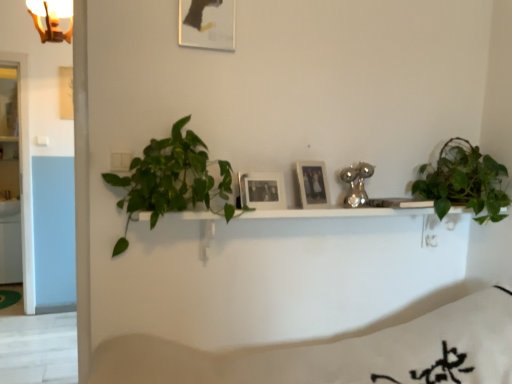
Describe the element at coordinates (207, 24) in the screenshot. I see `matte black picture frame at upper center, marked as the third picture frame in a right-to-left arrangement` at that location.

The width and height of the screenshot is (512, 384). What do you see at coordinates (313, 184) in the screenshot?
I see `matte black picture frame at center, the second picture frame positioned from the bottom` at bounding box center [313, 184].

Find the location of a particular element. This screenshot has height=384, width=512. white matte bedding at lower center is located at coordinates (338, 353).

The width and height of the screenshot is (512, 384). I want to click on green leafy plant at left, which ranks as the second houseplant in right-to-left order, so click(172, 180).

Describe the element at coordinates (464, 181) in the screenshot. I see `green matte plant at upper right, acting as the first houseplant starting from the right` at that location.

Where is `matte black picture frame at upper center, marked as the third picture frame in a right-to-left arrangement`? matte black picture frame at upper center, marked as the third picture frame in a right-to-left arrangement is located at coordinates (207, 24).

Considering the relative sizes of green matte plant at upper right, acting as the first houseplant starting from the right, and green leafy plant at left, marked as the first houseplant in a left-to-right arrangement, in the image provided, is green matte plant at upper right, acting as the first houseplant starting from the right, smaller than green leafy plant at left, marked as the first houseplant in a left-to-right arrangement,?

Correct, green matte plant at upper right, acting as the first houseplant starting from the right, occupies less space than green leafy plant at left, marked as the first houseplant in a left-to-right arrangement.

From a real-world perspective, who is located lower, green matte plant at upper right, placed as the 2th houseplant when sorted from left to right, or green leafy plant at left, marked as the first houseplant in a left-to-right arrangement?

From a 3D spatial view, green leafy plant at left, marked as the first houseplant in a left-to-right arrangement, is below.

Considering the relative sizes of green matte plant at upper right, acting as the first houseplant starting from the right, and green leafy plant at left, which ranks as the second houseplant in right-to-left order, in the image provided, is green matte plant at upper right, acting as the first houseplant starting from the right, taller than green leafy plant at left, which ranks as the second houseplant in right-to-left order,?

Incorrect, the height of green matte plant at upper right, acting as the first houseplant starting from the right, is not larger of that of green leafy plant at left, which ranks as the second houseplant in right-to-left order.

How many degrees apart are the facing directions of green matte plant at upper right, acting as the first houseplant starting from the right, and green leafy plant at left, marked as the first houseplant in a left-to-right arrangement?

1.12 degrees.

From their relative heights in the image, would you say matte black picture frame at center, the first picture frame positioned from the right, is taller or shorter than matte black picture frame at upper center, the 1th picture frame positioned from the top?

In the image, matte black picture frame at center, the first picture frame positioned from the right, appears to be shorter than matte black picture frame at upper center, the 1th picture frame positioned from the top.

Does matte black picture frame at center, positioned as the third picture frame in left-to-right order, appear on the right side of matte black picture frame at upper center, the third picture frame when ordered from bottom to top?

Correct, you'll find matte black picture frame at center, positioned as the third picture frame in left-to-right order, to the right of matte black picture frame at upper center, the third picture frame when ordered from bottom to top.

From a real-world perspective, is matte black picture frame at center, acting as the second picture frame starting from the top, on top of matte black picture frame at upper center, marked as the third picture frame in a right-to-left arrangement?

No.

Which of these two, matte black picture frame at center, positioned as the third picture frame in left-to-right order, or matte black picture frame at upper center, the third picture frame when ordered from bottom to top, is smaller?

With smaller size is matte black picture frame at center, positioned as the third picture frame in left-to-right order.

Which object is wider, matte black picture frame at upper center, the 1th picture frame positioned from the top, or green leafy plant at left, marked as the first houseplant in a left-to-right arrangement?

Wider between the two is green leafy plant at left, marked as the first houseplant in a left-to-right arrangement.

Does matte black picture frame at upper center, the third picture frame when ordered from bottom to top, turn towards green leafy plant at left, which ranks as the second houseplant in right-to-left order?

No, matte black picture frame at upper center, the third picture frame when ordered from bottom to top, is not aimed at green leafy plant at left, which ranks as the second houseplant in right-to-left order.

Consider the image. Would you say matte black picture frame at upper center, the third picture frame when ordered from bottom to top, is a long distance from green leafy plant at left, which ranks as the second houseplant in right-to-left order?

No, matte black picture frame at upper center, the third picture frame when ordered from bottom to top, is not far from green leafy plant at left, which ranks as the second houseplant in right-to-left order.

Can you tell me how much matte black picture frame at upper center, the 1th picture frame positioned from the top, and green leafy plant at left, marked as the first houseplant in a left-to-right arrangement, differ in facing direction?

The angular difference between matte black picture frame at upper center, the 1th picture frame positioned from the top, and green leafy plant at left, marked as the first houseplant in a left-to-right arrangement, is 0.513 degrees.

Can you tell me how much matte black picture frame at upper center, marked as the third picture frame in a right-to-left arrangement, and green matte plant at upper right, acting as the first houseplant starting from the right, differ in facing direction?

1.63 degrees separate the facing orientations of matte black picture frame at upper center, marked as the third picture frame in a right-to-left arrangement, and green matte plant at upper right, acting as the first houseplant starting from the right.

From the image's perspective, relative to green matte plant at upper right, placed as the 2th houseplant when sorted from left to right, is matte black picture frame at upper center, the third picture frame when ordered from bottom to top, above or below?

matte black picture frame at upper center, the third picture frame when ordered from bottom to top, is situated higher than green matte plant at upper right, placed as the 2th houseplant when sorted from left to right, in the image.

Is matte black picture frame at upper center, the 1th picture frame positioned from the top, at the left side of green matte plant at upper right, acting as the first houseplant starting from the right?

Indeed, matte black picture frame at upper center, the 1th picture frame positioned from the top, is positioned on the left side of green matte plant at upper right, acting as the first houseplant starting from the right.

Which is nearer, [222,32] or [496,203]?

The point [222,32] is closer.

How different are the orientations of white matte bedding at lower center and green leafy plant at left, which ranks as the second houseplant in right-to-left order, in degrees?

The facing directions of white matte bedding at lower center and green leafy plant at left, which ranks as the second houseplant in right-to-left order, are 0.209 degrees apart.

You are a GUI agent. You are given a task and a screenshot of the screen. Output one action in this format:
    pyautogui.click(x=<x>, y=<y>)
    Task: Click on the bedding on the right side of green leafy plant at left, marked as the first houseplant in a left-to-right arrangement
    The height and width of the screenshot is (384, 512).
    Given the screenshot: What is the action you would take?
    pyautogui.click(x=338, y=353)

Considering the relative sizes of white matte bedding at lower center and green leafy plant at left, marked as the first houseplant in a left-to-right arrangement, in the image provided, is white matte bedding at lower center wider than green leafy plant at left, marked as the first houseplant in a left-to-right arrangement,?

Yes, white matte bedding at lower center is wider than green leafy plant at left, marked as the first houseplant in a left-to-right arrangement.

Based on the photo, considering the positions of objects white matte bedding at lower center and green leafy plant at left, which ranks as the second houseplant in right-to-left order, in the image provided, who is more to the left, white matte bedding at lower center or green leafy plant at left, which ranks as the second houseplant in right-to-left order,?

green leafy plant at left, which ranks as the second houseplant in right-to-left order, is more to the left.

Considering the relative sizes of green matte plant at upper right, placed as the 2th houseplant when sorted from left to right, and white matte bedding at lower center in the image provided, is green matte plant at upper right, placed as the 2th houseplant when sorted from left to right, shorter than white matte bedding at lower center?

Correct, green matte plant at upper right, placed as the 2th houseplant when sorted from left to right, is not as tall as white matte bedding at lower center.

Is the depth of green matte plant at upper right, placed as the 2th houseplant when sorted from left to right, less than that of white matte bedding at lower center?

No, the depth of green matte plant at upper right, placed as the 2th houseplant when sorted from left to right, is greater than that of white matte bedding at lower center.

What's the angular difference between green matte plant at upper right, placed as the 2th houseplant when sorted from left to right, and white matte bedding at lower center's facing directions?

There is a 1.33-degree angle between the facing directions of green matte plant at upper right, placed as the 2th houseplant when sorted from left to right, and white matte bedding at lower center.

Can we say green matte plant at upper right, acting as the first houseplant starting from the right, lies outside white matte bedding at lower center?

Yes, green matte plant at upper right, acting as the first houseplant starting from the right, is not within white matte bedding at lower center.

From a real-world perspective, is matte black picture frame at center, acting as the second picture frame starting from the top, beneath gold metallic light fixture at upper left?

Yes, from a real-world perspective, matte black picture frame at center, acting as the second picture frame starting from the top, is beneath gold metallic light fixture at upper left.

Between matte black picture frame at center, the second picture frame positioned from the bottom, and gold metallic light fixture at upper left, which one has larger size?

gold metallic light fixture at upper left.

Is matte black picture frame at center, acting as the second picture frame starting from the top, taller or shorter than gold metallic light fixture at upper left?

In the image, matte black picture frame at center, acting as the second picture frame starting from the top, appears to be shorter than gold metallic light fixture at upper left.

Is matte black picture frame at center, the second picture frame positioned from the bottom, facing towards gold metallic light fixture at upper left?

No, matte black picture frame at center, the second picture frame positioned from the bottom, is not oriented towards gold metallic light fixture at upper left.

Locate an element on the screen. This screenshot has width=512, height=384. houseplant lying on the left of green matte plant at upper right, acting as the first houseplant starting from the right is located at coordinates (172, 180).

This screenshot has height=384, width=512. Identify the location of picture frame that is the 1st object located below the matte black picture frame at upper center, marked as the third picture frame in a right-to-left arrangement (from the image's perspective). (313, 184).

Based on their spatial positions, is gold metallic light fixture at upper left or matte black picture frame at upper center, the 1th picture frame positioned from the top, further from matte black picture frame at center, the second picture frame positioned from the bottom?

gold metallic light fixture at upper left.

In the scene shown: Looking at the image, which one is located closer to gold metallic light fixture at upper left, green matte plant at upper right, placed as the 2th houseplant when sorted from left to right, or black matte picture frame at center, the 3th picture frame when ordered from top to bottom?

black matte picture frame at center, the 3th picture frame when ordered from top to bottom.

Looking at the image, which one is located closer to gold metallic light fixture at upper left, green leafy plant at left, marked as the first houseplant in a left-to-right arrangement, or black matte picture frame at center, which is counted as the 2th picture frame, starting from the right?

green leafy plant at left, marked as the first houseplant in a left-to-right arrangement.

When comparing their distances from green matte plant at upper right, acting as the first houseplant starting from the right, does matte black picture frame at upper center, the third picture frame when ordered from bottom to top, or green leafy plant at left, marked as the first houseplant in a left-to-right arrangement, seem closer?

green leafy plant at left, marked as the first houseplant in a left-to-right arrangement, is closer to green matte plant at upper right, acting as the first houseplant starting from the right.

When comparing their distances from matte black picture frame at upper center, the 1th picture frame positioned from the top, does green leafy plant at left, marked as the first houseplant in a left-to-right arrangement, or green matte plant at upper right, placed as the 2th houseplant when sorted from left to right, seem closer?

The object closer to matte black picture frame at upper center, the 1th picture frame positioned from the top, is green leafy plant at left, marked as the first houseplant in a left-to-right arrangement.

From the picture: Estimate the real-world distances between objects in this image. Which object is further from gold metallic light fixture at upper left, green matte plant at upper right, placed as the 2th houseplant when sorted from left to right, or green leafy plant at left, which ranks as the second houseplant in right-to-left order?

green matte plant at upper right, placed as the 2th houseplant when sorted from left to right.

Consider the image. Looking at the image, which one is located further to white matte bedding at lower center, matte black picture frame at upper center, the first picture frame viewed from the left, or green matte plant at upper right, acting as the first houseplant starting from the right?

Among the two, matte black picture frame at upper center, the first picture frame viewed from the left, is located further to white matte bedding at lower center.

Looking at this image, based on their spatial positions, is matte black picture frame at center, the second picture frame positioned from the bottom, or matte black picture frame at upper center, the third picture frame when ordered from bottom to top, further from black matte picture frame at center, which is counted as the 2th picture frame, starting from the right?

matte black picture frame at upper center, the third picture frame when ordered from bottom to top, is further to black matte picture frame at center, which is counted as the 2th picture frame, starting from the right.

Locate an element on the screen. Image resolution: width=512 pixels, height=384 pixels. bedding between green leafy plant at left, marked as the first houseplant in a left-to-right arrangement, and green matte plant at upper right, placed as the 2th houseplant when sorted from left to right is located at coordinates (338, 353).

The height and width of the screenshot is (384, 512). In order to click on houseplant between white matte bedding at lower center and black matte picture frame at center, the 1th picture frame from the bottom, along the z-axis in this screenshot , I will do `click(172, 180)`.

What are the coordinates of `houseplant located between gold metallic light fixture at upper left and matte black picture frame at center, the second picture frame positioned from the bottom, in the left-right direction` in the screenshot? It's located at (172, 180).

Where is `houseplant located between gold metallic light fixture at upper left and black matte picture frame at center, the 1th picture frame from the bottom, in the left-right direction`? houseplant located between gold metallic light fixture at upper left and black matte picture frame at center, the 1th picture frame from the bottom, in the left-right direction is located at coordinates (172, 180).